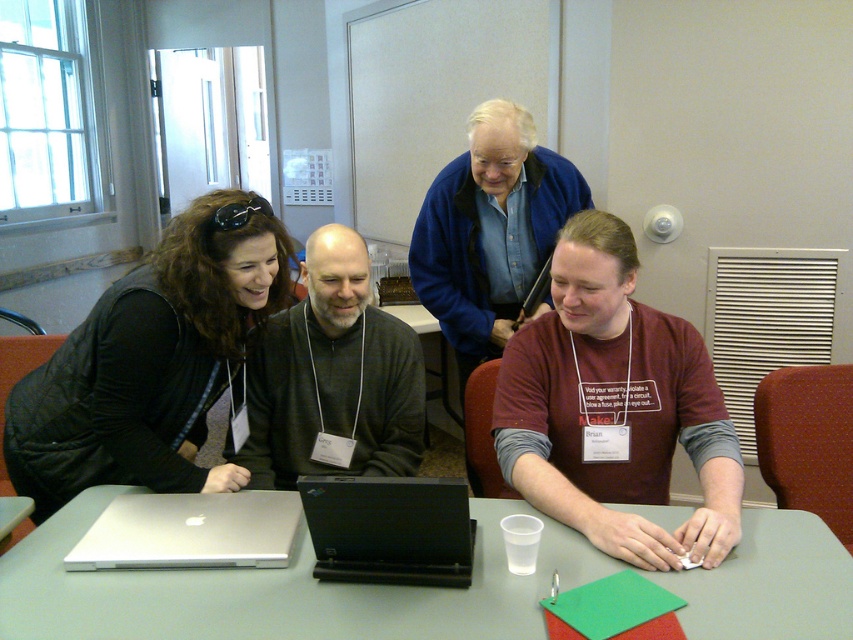
You are organizing a meeting in this conference room and need to place a matte black jacket at left and a black plastic laptop at center on the table. Given their sizes, which item would require more horizontal space on the table?

The matte black jacket at left requires more horizontal space because its width surpasses that of the black plastic laptop at center.